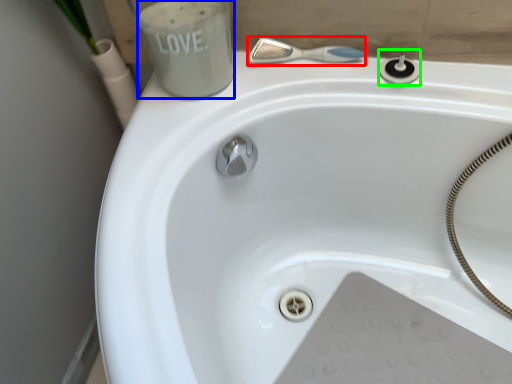
Question: Which is farther away from shower (highlighted by a red box)? liquid (highlighted by a blue box) or plumbing fixture (highlighted by a green box)?

Choices:
 (A) liquid
 (B) plumbing fixture

Answer: (A)